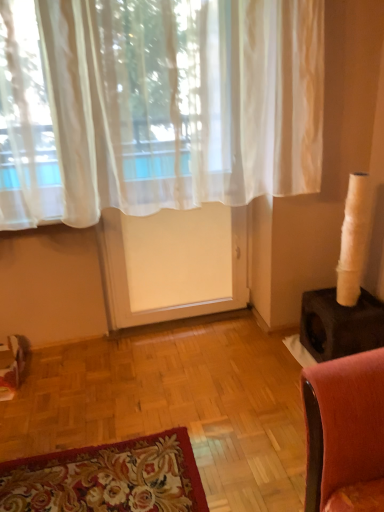
Question: Is sheer white curtain at upper center to the right of white sheer screen door at center from the viewer's perspective?

Choices:
 (A) no
 (B) yes

Answer: (B)

Question: Is sheer white curtain at upper center placed right next to white sheer screen door at center?

Choices:
 (A) no
 (B) yes

Answer: (A)

Question: Is white sheer screen door at center surrounded by sheer white curtain at upper center?

Choices:
 (A) yes
 (B) no

Answer: (B)

Question: Could you tell me if sheer white curtain at upper center is turned towards white sheer screen door at center?

Choices:
 (A) yes
 (B) no

Answer: (B)

Question: Considering the relative sizes of sheer white curtain at upper center and white sheer screen door at center in the image provided, is sheer white curtain at upper center bigger than white sheer screen door at center?

Choices:
 (A) no
 (B) yes

Answer: (B)

Question: From a real-world perspective, is sheer white curtain at upper center located higher than white sheer screen door at center?

Choices:
 (A) no
 (B) yes

Answer: (B)

Question: Can you confirm if white sheer screen door at center is shorter than sheer white curtain at upper center?

Choices:
 (A) yes
 (B) no

Answer: (B)

Question: Does white sheer screen door at center appear on the left side of sheer white curtain at upper center?

Choices:
 (A) no
 (B) yes

Answer: (B)

Question: Is white sheer screen door at center facing towards sheer white curtain at upper center?

Choices:
 (A) yes
 (B) no

Answer: (A)

Question: Is white sheer screen door at center smaller than sheer white curtain at upper center?

Choices:
 (A) no
 (B) yes

Answer: (B)

Question: Can you confirm if white sheer screen door at center is taller than sheer white curtain at upper center?

Choices:
 (A) yes
 (B) no

Answer: (A)

Question: From a real-world perspective, is white sheer screen door at center below sheer white curtain at upper center?

Choices:
 (A) yes
 (B) no

Answer: (A)

Question: Is white sheer screen door at center inside or outside of sheer white curtain at upper center?

Choices:
 (A) inside
 (B) outside

Answer: (B)